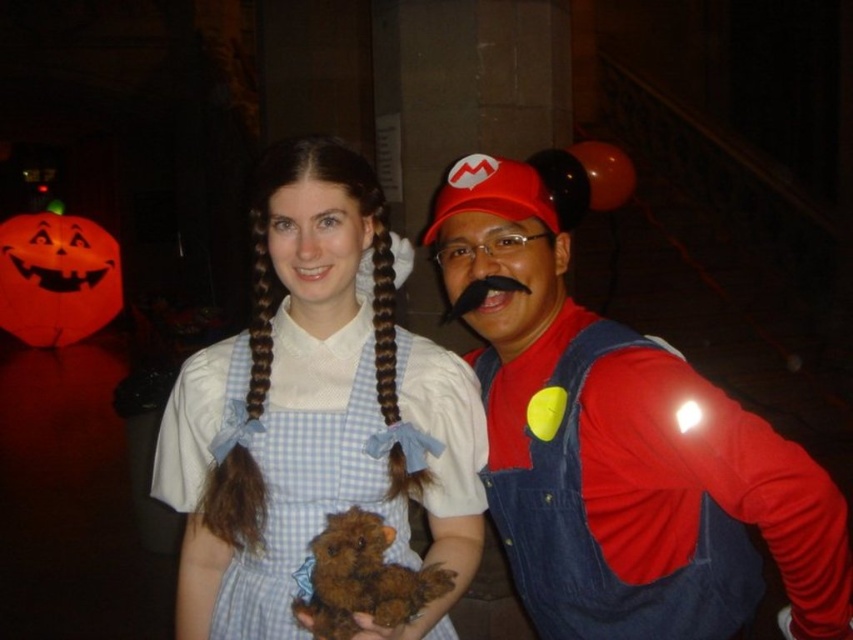
Question: Does blue checkered dress at center appear on the right side of brown plush toy at center?

Choices:
 (A) yes
 (B) no

Answer: (B)

Question: Among these objects, which one is farthest from the camera?

Choices:
 (A) brown silky hair at center
 (B) blue checkered dress at center
 (C) brown plush toy at center

Answer: (A)

Question: Does red denim overalls at right have a smaller size compared to blue checkered dress at center?

Choices:
 (A) yes
 (B) no

Answer: (B)

Question: Among these points, which one is farthest from the camera?

Choices:
 (A) (651, 580)
 (B) (285, 323)

Answer: (B)

Question: In this image, where is brown plush toy at center located relative to brown silky hair at center?

Choices:
 (A) above
 (B) below

Answer: (B)

Question: Among these objects, which one is farthest from the camera?

Choices:
 (A) brown silky hair at center
 (B) blue checkered dress at center
 (C) brown plush toy at center
 (D) red denim overalls at right

Answer: (A)